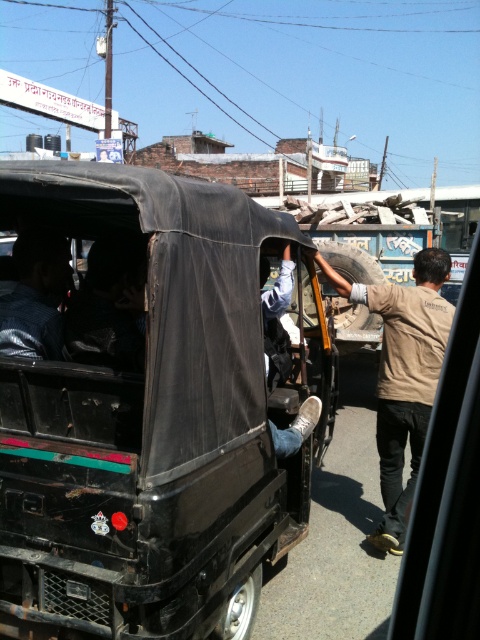
You are a pedestrian standing in front of the black matte jeep at center and the dark blue shirt at rear left. Which object is nearer to you?

The black matte jeep at center is closer to the viewer than the dark blue shirt at rear left.

You are standing at the point with coordinates (147, 403) in the urban street scene. What object are you positioned at?

The point at coordinates (147, 403) indicates the black matte jeep at center.